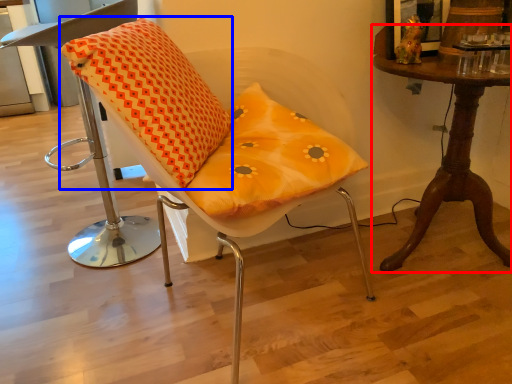
Question: Which of the following is the closest to the observer, table (highlighted by a red box) or throw pillow (highlighted by a blue box)?

Choices:
 (A) table
 (B) throw pillow

Answer: (B)